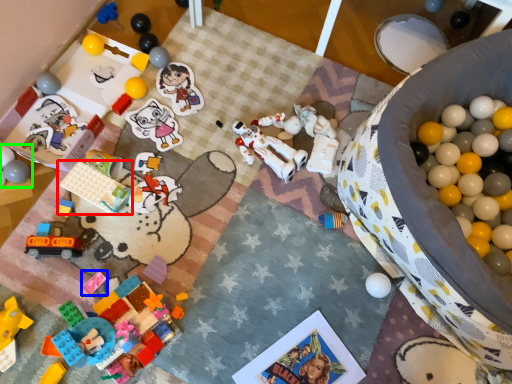
Question: Which is nearer to the toy (highlighted by a red box)? toy (highlighted by a blue box) or toy (highlighted by a green box).

Choices:
 (A) toy
 (B) toy

Answer: (B)